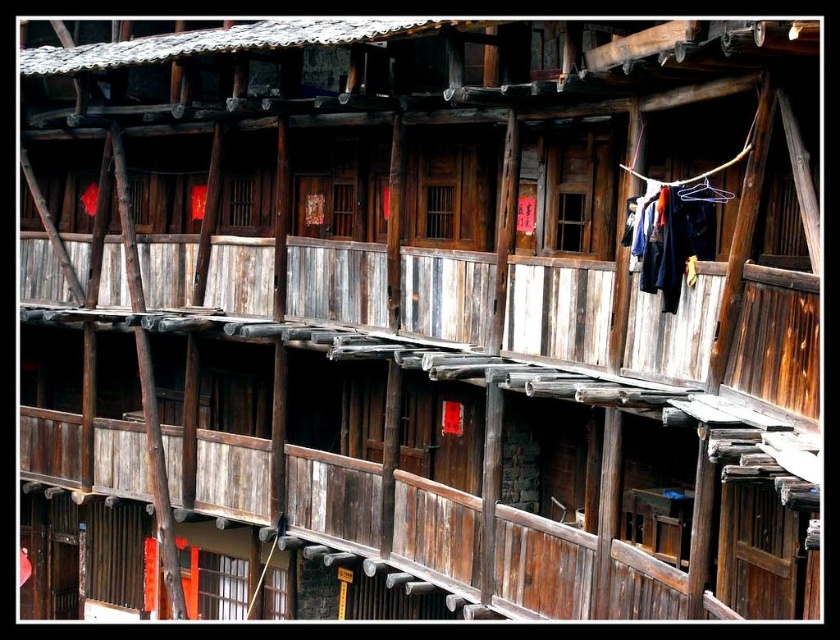
You are standing in front of the multi story wooden building and notice two items at the upper right corner. Which one is closer to you, the dark blue fabric at upper right or the black fabric hanger at upper right?

The dark blue fabric at upper right is closer to you because it is further to the viewer than the black fabric hanger at upper right.

You are a tailor working in this traditional building and need to hang a new piece of fabric on the balcony at the upper right. The fabric is 1.2 meters wide. Can you place it between the dark blue fabric at upper right and the black fabric hanger at upper right without folding it?

The dark blue fabric at upper right and the black fabric hanger at upper right are 1.07 meters apart from each other. Since the new fabric is 1.2 meters wide, it cannot fit between them without folding.

You are standing in front of the traditional Chinese building and see a point marked at coordinates (672, 236). What color fabric is this point located on?

The point is located on dark blue fabric at upper right.